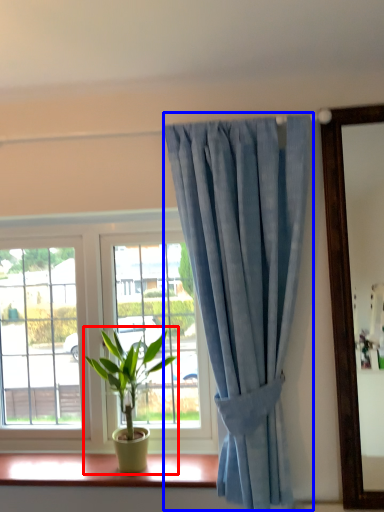
Question: Which point is further to the camera, houseplant (highlighted by a red box) or curtain (highlighted by a blue box)?

Choices:
 (A) houseplant
 (B) curtain

Answer: (A)